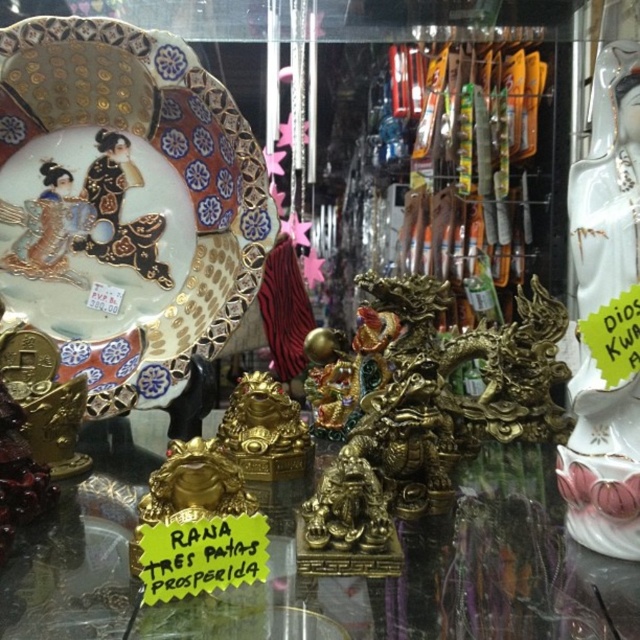
Does porcelain painted plate at upper left have a larger size compared to porcelain statue at right?

Yes, porcelain painted plate at upper left is bigger than porcelain statue at right.

Where is `porcelain painted plate at upper left`? This screenshot has width=640, height=640. porcelain painted plate at upper left is located at coordinates (125, 204).

The image size is (640, 640). Describe the element at coordinates (440, 576) in the screenshot. I see `gold metallic statue at center` at that location.

Which is behind, point (65, 492) or point (586, 472)?

Positioned behind is point (65, 492).

Is point (432, 541) positioned in front of point (625, 132)?

No, it is not.

The height and width of the screenshot is (640, 640). What are the coordinates of `gold metallic statue at center` in the screenshot? It's located at (440, 576).

Is porcelain painted plate at upper left closer to camera compared to gold metallic statue at center?

That is False.

Can you confirm if porcelain painted plate at upper left is wider than gold metallic statue at center?

Incorrect, porcelain painted plate at upper left's width does not surpass gold metallic statue at center's.

Describe the element at coordinates (125, 204) in the screenshot. I see `porcelain painted plate at upper left` at that location.

Where is `porcelain painted plate at upper left`? porcelain painted plate at upper left is located at coordinates (125, 204).